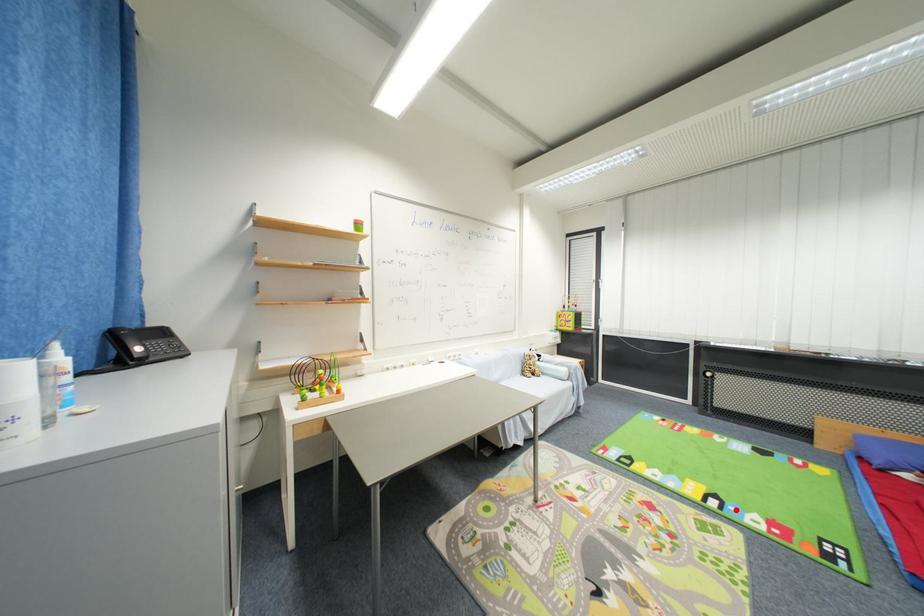
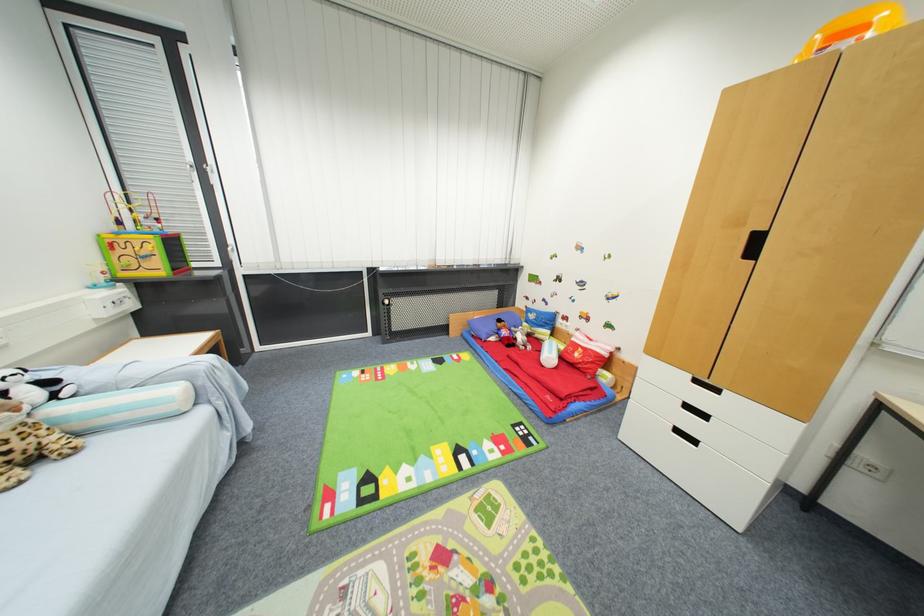
Where in the second image is the point corresponding to the highlighted location from the first image?

(479, 455)